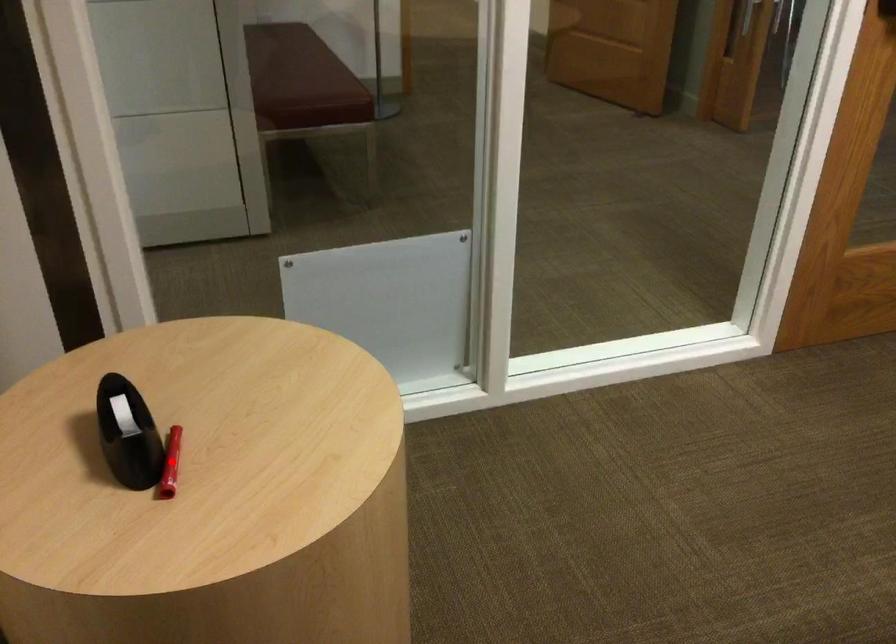
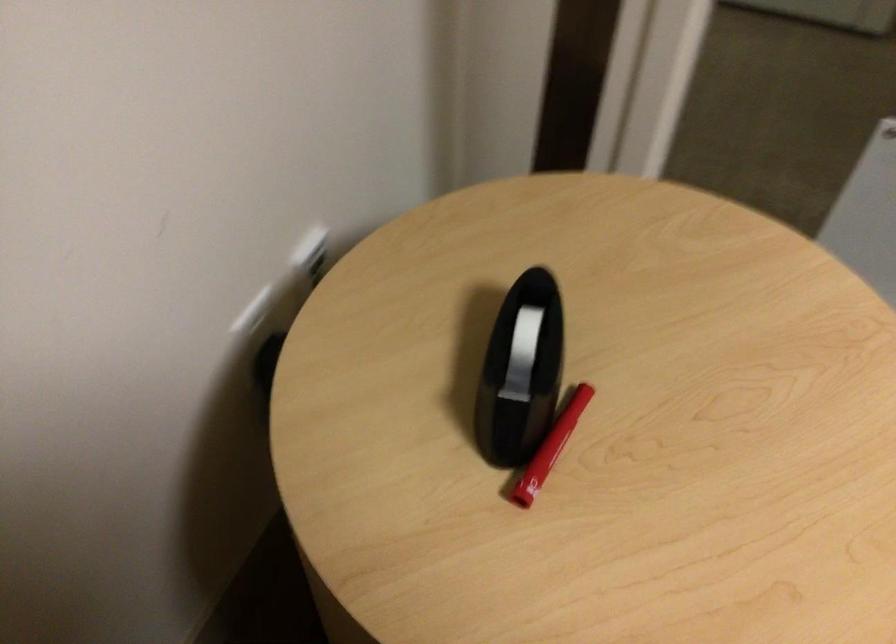
Question: I am providing you with two images of the same scene from different viewpoints. Given a red point in image1, look at the same physical point in image2. Is it:

Choices:
 (A) Closer to the viewpoint
 (B) Farther from the viewpoint

Answer: (A)